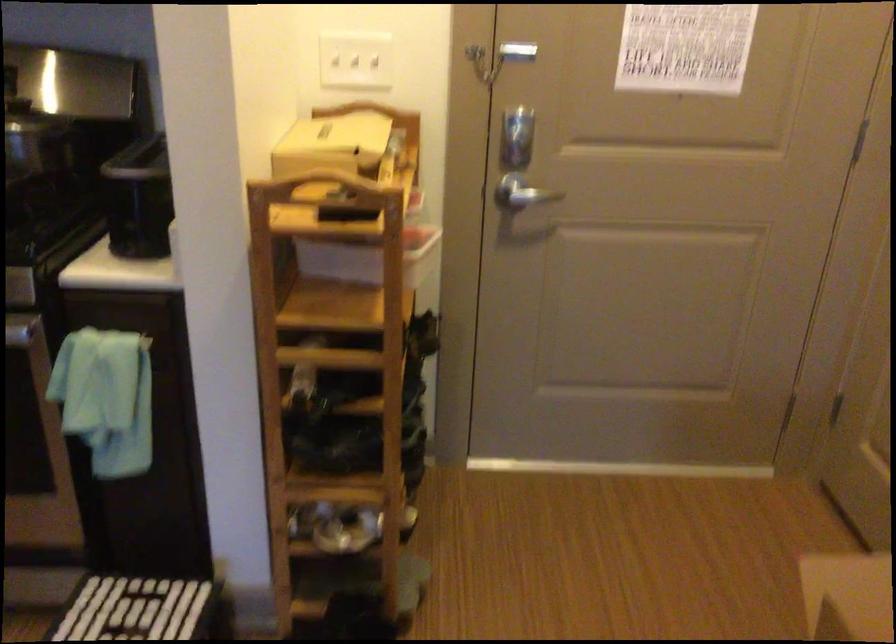
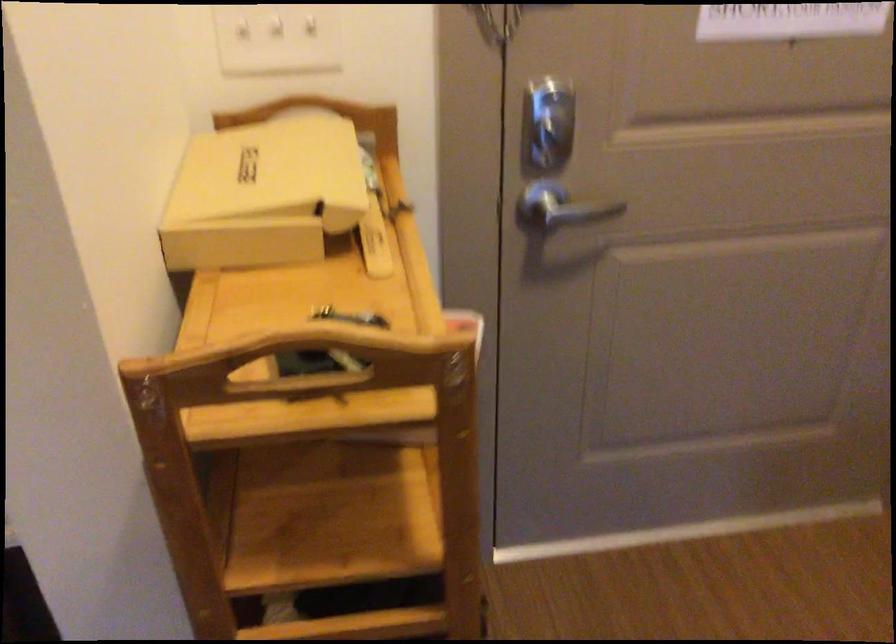
Find the pixel in the second image that matches (x=523, y=134) in the first image.

(547, 122)